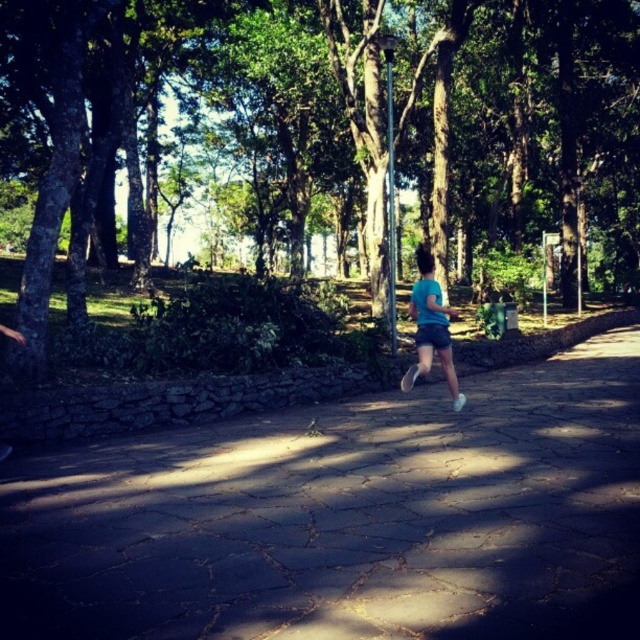
Is paved stone path at center to the right of blue matte shorts at center from the viewer's perspective?

Incorrect, paved stone path at center is not on the right side of blue matte shorts at center.

Does point (100, 541) lie in front of point (413, 301)?

Yes.

Does point (154, 627) lie in front of point (433, 349)?

Yes, point (154, 627) is closer to viewer.

Where is `paved stone path at center`? This screenshot has height=640, width=640. paved stone path at center is located at coordinates (346, 516).

Is point (612, 147) closer to camera compared to point (435, 346)?

No, it is not.

Between green leafy tree at center and blue matte shorts at center, which one has less height?

blue matte shorts at center

Is point (536, 124) positioned behind point (429, 356)?

Yes, it is.

At what (x,y) coordinates should I click in order to perform the action: click on green leafy tree at center. Please return your answer as a coordinate pair (x, y). Looking at the image, I should click on (372, 116).

Between paved stone path at center and green leafy tree at center, which one has more height?

green leafy tree at center

Who is more distant from viewer, (x=211, y=548) or (x=428, y=200)?

The point (x=428, y=200) is behind.

Which is behind, point (262, 481) or point (483, 161)?

The point (483, 161) is more distant.

Find the location of a particular element. paved stone path at center is located at coordinates (346, 516).